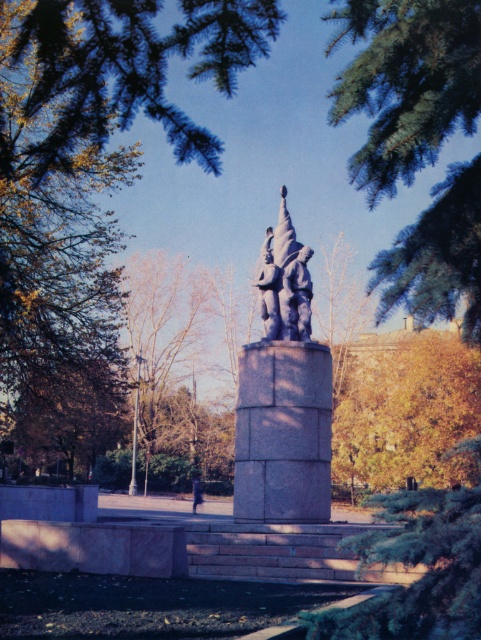
Question: Which point is farther to the camera?

Choices:
 (A) (383, 422)
 (B) (262, 518)
 (C) (288, 298)
 (D) (467, 525)

Answer: (A)

Question: Is green textured tree at center bigger than blue fabric dress at center?

Choices:
 (A) no
 (B) yes

Answer: (B)

Question: Among these objects, which one is nearest to the camera?

Choices:
 (A) green textured tree at center
 (B) green needle-like leaves at upper center

Answer: (A)

Question: Can you confirm if green textured tree at center is smaller than blue fabric dress at center?

Choices:
 (A) no
 (B) yes

Answer: (A)

Question: Does polished bronze statue at center appear on the right side of blue fabric dress at center?

Choices:
 (A) yes
 (B) no

Answer: (A)

Question: Which object is positioned closest to the green textured tree at center?

Choices:
 (A) green needle-like leaves at upper center
 (B) blue stone sculpture at center

Answer: (A)